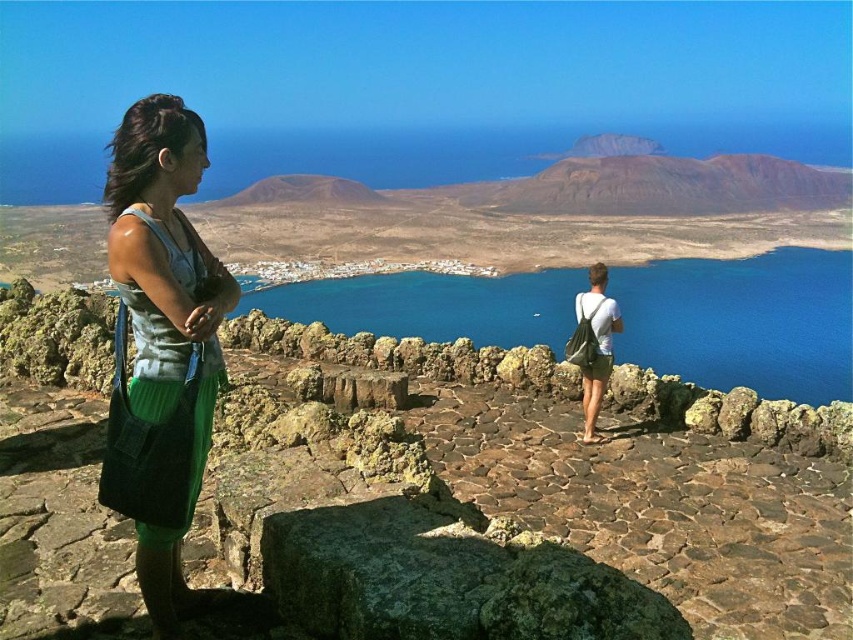
Question: Which object is positioned farthest from the green canvas backpack at right?

Choices:
 (A) rusty stone wall at center
 (B) green corduroy skirt at left
 (C) blue water at center

Answer: (C)

Question: Can you confirm if rusty stone wall at center is thinner than blue water at center?

Choices:
 (A) no
 (B) yes

Answer: (B)

Question: Among these points, which one is farthest from the camera?

Choices:
 (A) (648, 449)
 (B) (740, 365)
 (C) (596, 301)

Answer: (B)

Question: Is rusty stone wall at center smaller than green canvas backpack at right?

Choices:
 (A) yes
 (B) no

Answer: (B)

Question: Among these points, which one is farthest from the camera?

Choices:
 (A) (578, 296)
 (B) (834, 317)

Answer: (B)

Question: Is blue water at center below green canvas backpack at right?

Choices:
 (A) no
 (B) yes

Answer: (A)